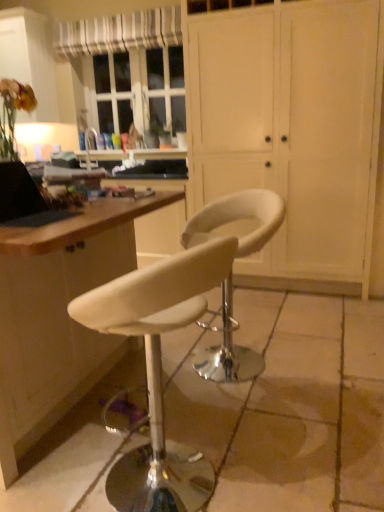
The height and width of the screenshot is (512, 384). Identify the location of unoccupied space behind white leather stool at center, which appears as the first chair when viewed from the back. (258, 324).